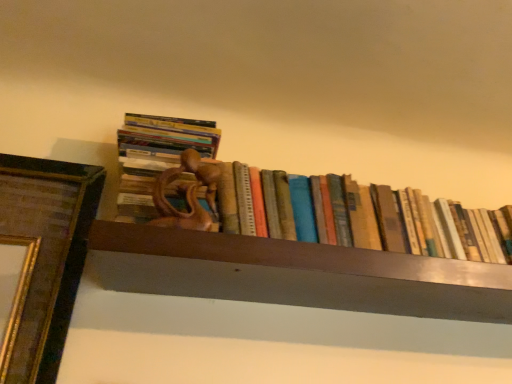
Question: Should I look upward or downward to see old paper book at center, the first book in the right-to-left sequence?

Choices:
 (A) up
 (B) down

Answer: (B)

Question: Is wooden statue at center, which is the 1th book from left to right, wider than old paper book at center, which is the second book in left-to-right order?

Choices:
 (A) no
 (B) yes

Answer: (B)

Question: From the image's perspective, is wooden statue at center, which is the 1th book from left to right, above old paper book at center, the first book in the right-to-left sequence?

Choices:
 (A) yes
 (B) no

Answer: (A)

Question: Is wooden statue at center, which is the 1th book from left to right, taller than old paper book at center, the first book in the right-to-left sequence?

Choices:
 (A) yes
 (B) no

Answer: (A)

Question: Is wooden statue at center, which is the 1th book from left to right, shorter than old paper book at center, the first book in the right-to-left sequence?

Choices:
 (A) no
 (B) yes

Answer: (A)

Question: Is wooden statue at center, acting as the second book starting from the right, surrounding old paper book at center, which is the second book in left-to-right order?

Choices:
 (A) no
 (B) yes

Answer: (A)

Question: Is wooden statue at center, acting as the second book starting from the right, facing away from old paper book at center, the first book in the right-to-left sequence?

Choices:
 (A) yes
 (B) no

Answer: (B)

Question: Is old paper book at center, the first book in the right-to-left sequence, bigger than wooden statue at center, acting as the second book starting from the right?

Choices:
 (A) yes
 (B) no

Answer: (A)

Question: Can you confirm if old paper book at center, the first book in the right-to-left sequence, is positioned to the right of wooden statue at center, which is the 1th book from left to right?

Choices:
 (A) no
 (B) yes

Answer: (B)

Question: Can you confirm if old paper book at center, the first book in the right-to-left sequence, is shorter than wooden statue at center, acting as the second book starting from the right?

Choices:
 (A) yes
 (B) no

Answer: (A)

Question: Is old paper book at center, which is the second book in left-to-right order, wider than wooden statue at center, acting as the second book starting from the right?

Choices:
 (A) yes
 (B) no

Answer: (B)

Question: Is old paper book at center, which is the second book in left-to-right order, not within wooden statue at center, which is the 1th book from left to right?

Choices:
 (A) yes
 (B) no

Answer: (A)

Question: Is old paper book at center, which is the second book in left-to-right order, facing towards wooden statue at center, acting as the second book starting from the right?

Choices:
 (A) no
 (B) yes

Answer: (A)

Question: From a real-world perspective, is old paper book at center, which is the second book in left-to-right order, positioned above or below wooden statue at center, acting as the second book starting from the right?

Choices:
 (A) below
 (B) above

Answer: (A)